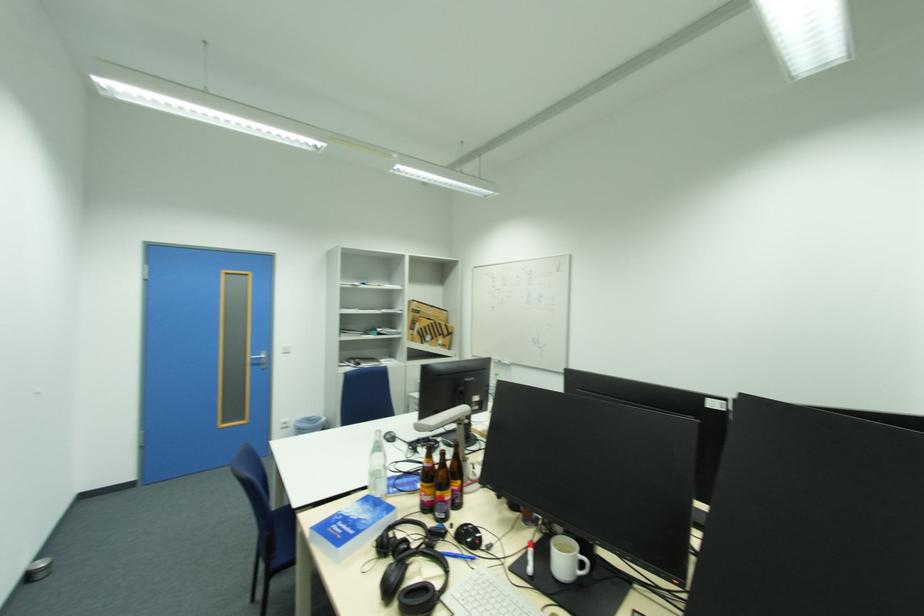
Describe the element at coordinates (566, 559) in the screenshot. I see `the white mug handle` at that location.